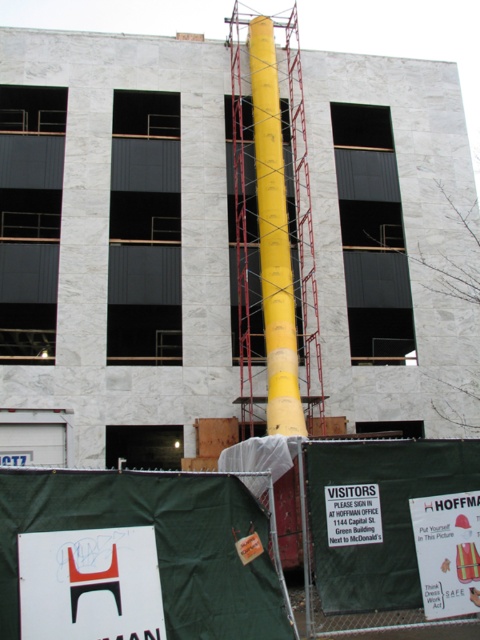
Does yellow plastic pipe at center appear on the right side of white paper sign at lower right?

No, yellow plastic pipe at center is not to the right of white paper sign at lower right.

In the scene shown: Is yellow plastic pipe at center smaller than white paper sign at lower right?

Incorrect, yellow plastic pipe at center is not smaller in size than white paper sign at lower right.

Locate an element on the screen. This screenshot has width=480, height=640. yellow plastic pipe at center is located at coordinates (156, 544).

Is point (123, 621) behind point (263, 269)?

That is False.

Is matte white sign at lower left closer to the viewer compared to yellow matte pole at center?

Yes.

Is point (41, 625) farther from camera compared to point (271, 168)?

No, (41, 625) is in front of (271, 168).

You are a GUI agent. You are given a task and a screenshot of the screen. Output one action in this format:
    pyautogui.click(x=<x>, y=<y>)
    Task: Click on the matte white sign at lower left
    This screenshot has height=640, width=480.
    Given the screenshot: What is the action you would take?
    pyautogui.click(x=90, y=584)

Can you confirm if yellow smooth pole at center is positioned to the right of white paper sign at lower right?

In fact, yellow smooth pole at center is to the left of white paper sign at lower right.

Is yellow smooth pole at center smaller than white paper sign at lower right?

Incorrect, yellow smooth pole at center is not smaller in size than white paper sign at lower right.

Find the location of a particular element. The width and height of the screenshot is (480, 640). yellow smooth pole at center is located at coordinates (115, 244).